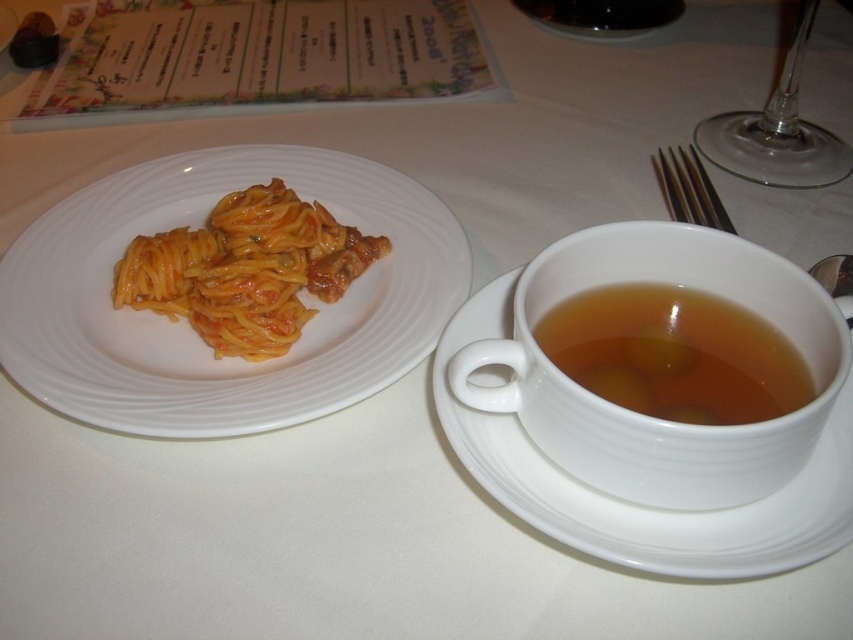
Which is more to the left, brown translucent cup at right or silver metallic fork at upper right?

brown translucent cup at right

Does point (712, 410) lie in front of point (688, 200)?

Yes.

I want to click on brown translucent cup at right, so click(675, 355).

Which is more to the left, white ceramic plate at upper left or silver metallic fork at upper right?

white ceramic plate at upper left

Measure the distance between white ceramic plate at upper left and silver metallic fork at upper right.

They are 13.14 inches apart.

Who is more forward, [253,413] or [659,166]?

Point [253,413]

Find the location of a particular element. white ceramic plate at upper left is located at coordinates (187, 323).

Can you confirm if brown translucent cup at right is shorter than yellow matte pasta at left?

Indeed, brown translucent cup at right has a lesser height compared to yellow matte pasta at left.

Does brown translucent cup at right appear over yellow matte pasta at left?

No.

Does point (733, 328) come behind point (142, 291)?

No.

Where is `brown translucent cup at right`? The height and width of the screenshot is (640, 853). brown translucent cup at right is located at coordinates (675, 355).